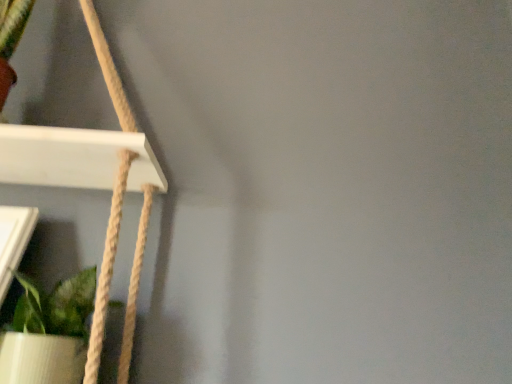
The image size is (512, 384). Find the location of `green matte plant at lower left`. green matte plant at lower left is located at coordinates tap(49, 332).

What do you see at coordinates (49, 332) in the screenshot?
I see `green matte plant at lower left` at bounding box center [49, 332].

This screenshot has height=384, width=512. I want to click on green matte plant at lower left, so click(49, 332).